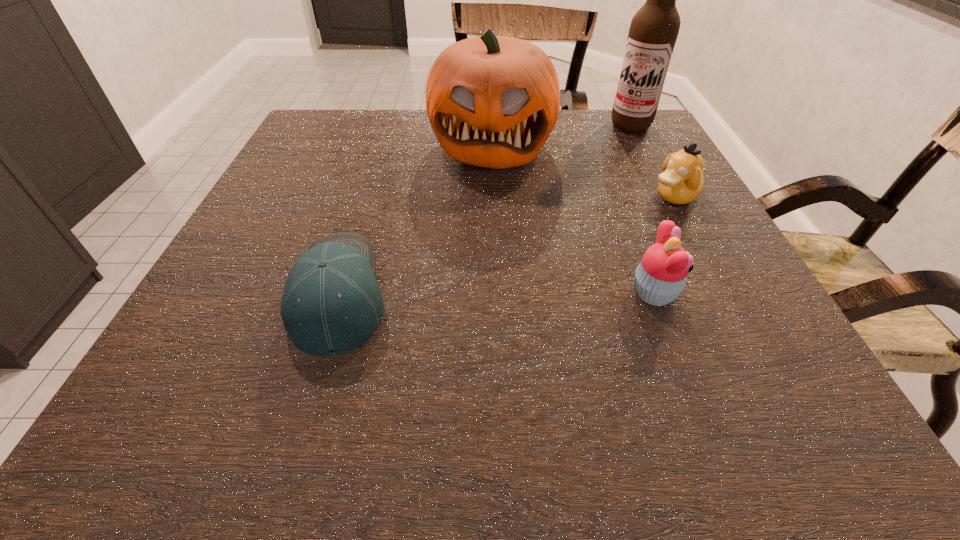
The height and width of the screenshot is (540, 960). In order to click on vacant space on the desktop that is between the baseball cap and the third object from left to right and is positioned on the face of the fourth shortest object in this screenshot , I will do `click(471, 293)`.

Identify the location of vacant space on the desktop that is between the leftmost object and the third object from left to right and is positioned on the label of the tallest object. Image resolution: width=960 pixels, height=540 pixels. (515, 293).

At what (x,y) coordinates should I click in order to perform the action: click on vacant space on the desktop that is between the shortest object and the cupcake and is positioned on the face of the duckling. Please return your answer as a coordinate pair (x, y). Looking at the image, I should click on (470, 293).